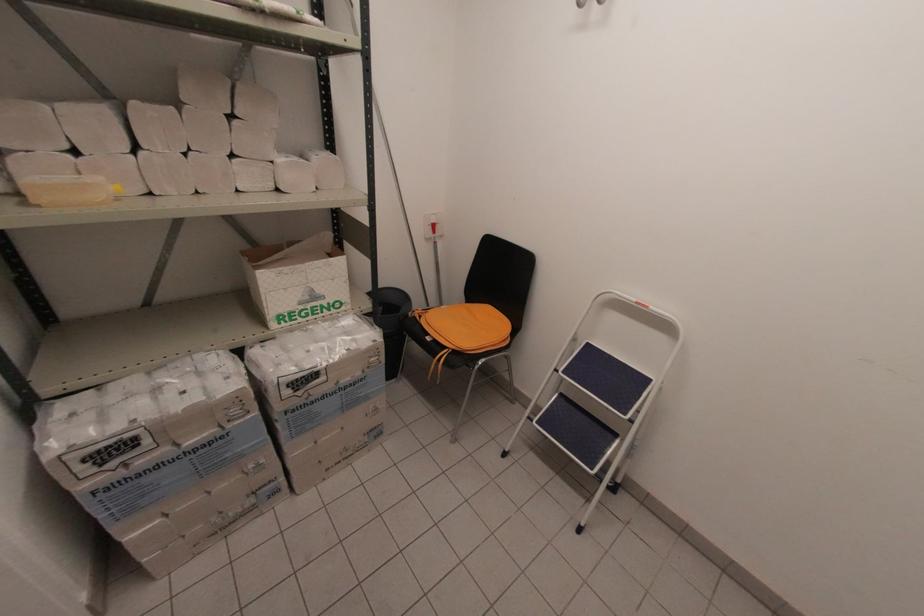
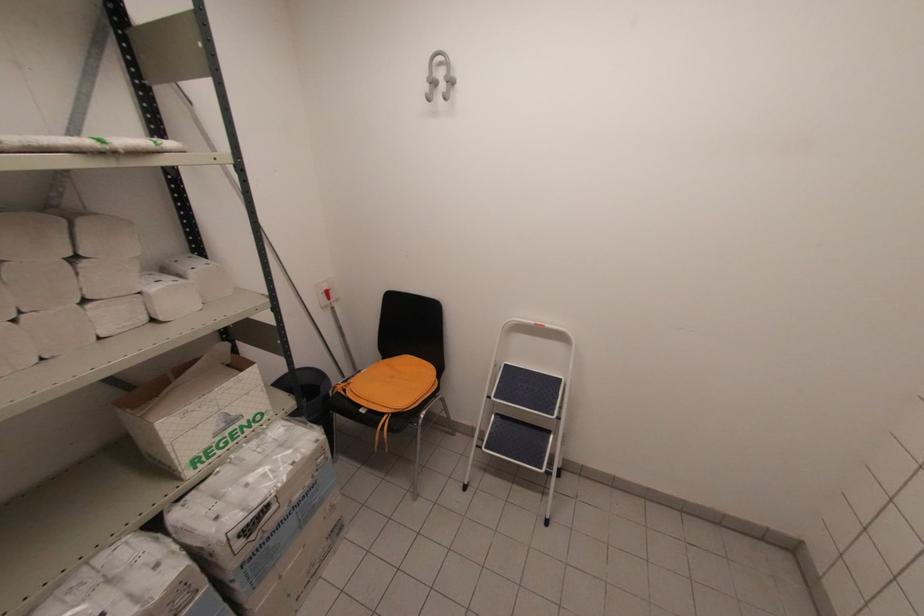
Where in the second image is the point corresponding to (x=435, y=233) from the first image?

(330, 299)